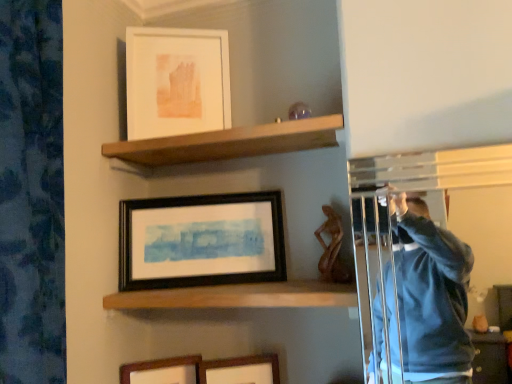
Question: Which direction should I rotate to look at wooden picture frame at lower center, the 3th picture frame from the top?

Choices:
 (A) right
 (B) left

Answer: (B)

Question: From the image's perspective, is wooden shelf at center, which is the 2th shelf in top-to-bottom order, located above white matte picture frame at upper center, arranged as the first picture frame when viewed from the top?

Choices:
 (A) no
 (B) yes

Answer: (A)

Question: Is wooden shelf at center, which is the 2th shelf in top-to-bottom order, to the right of white matte picture frame at upper center, the fourth picture frame positioned from the bottom, from the viewer's perspective?

Choices:
 (A) no
 (B) yes

Answer: (B)

Question: From a real-world perspective, is wooden shelf at center, which is the 2th shelf in top-to-bottom order, beneath white matte picture frame at upper center, arranged as the first picture frame when viewed from the top?

Choices:
 (A) no
 (B) yes

Answer: (B)

Question: Is wooden shelf at center, which is the 2th shelf in top-to-bottom order, positioned with its back to white matte picture frame at upper center, arranged as the first picture frame when viewed from the top?

Choices:
 (A) yes
 (B) no

Answer: (B)

Question: Is wooden shelf at center, which is the 2th shelf in top-to-bottom order, positioned before white matte picture frame at upper center, the fourth picture frame positioned from the bottom?

Choices:
 (A) yes
 (B) no

Answer: (A)

Question: Does wooden shelf at center, which is the 2th shelf in top-to-bottom order, come behind white matte picture frame at upper center, the fourth picture frame positioned from the bottom?

Choices:
 (A) yes
 (B) no

Answer: (B)

Question: From the image's perspective, is white matte picture frame at upper center, the fourth picture frame positioned from the bottom, on wooden shelf at upper center, which is counted as the first shelf, starting from the top?

Choices:
 (A) yes
 (B) no

Answer: (A)

Question: From a real-world perspective, is white matte picture frame at upper center, the fourth picture frame positioned from the bottom, located higher than wooden shelf at upper center, which is counted as the first shelf, starting from the top?

Choices:
 (A) yes
 (B) no

Answer: (A)

Question: Could wooden shelf at upper center, which is counted as the first shelf, starting from the top, be considered to be inside white matte picture frame at upper center, arranged as the first picture frame when viewed from the top?

Choices:
 (A) no
 (B) yes

Answer: (A)

Question: Can you confirm if white matte picture frame at upper center, arranged as the first picture frame when viewed from the top, is positioned to the left of wooden shelf at upper center, which is counted as the first shelf, starting from the top?

Choices:
 (A) no
 (B) yes

Answer: (B)

Question: Is white matte picture frame at upper center, the fourth picture frame positioned from the bottom, thinner than wooden shelf at upper center, which ranks as the 2th shelf in bottom-to-top order?

Choices:
 (A) yes
 (B) no

Answer: (A)

Question: Considering the relative sizes of white matte picture frame at upper center, the fourth picture frame positioned from the bottom, and wooden shelf at upper center, which is counted as the first shelf, starting from the top, in the image provided, is white matte picture frame at upper center, the fourth picture frame positioned from the bottom, taller than wooden shelf at upper center, which is counted as the first shelf, starting from the top,?

Choices:
 (A) no
 (B) yes

Answer: (B)

Question: Does wooden shelf at center, the 1th shelf in the bottom-to-top sequence, appear on the left side of wooden picture frame at lower center, which is the first picture frame from bottom to top?

Choices:
 (A) yes
 (B) no

Answer: (B)